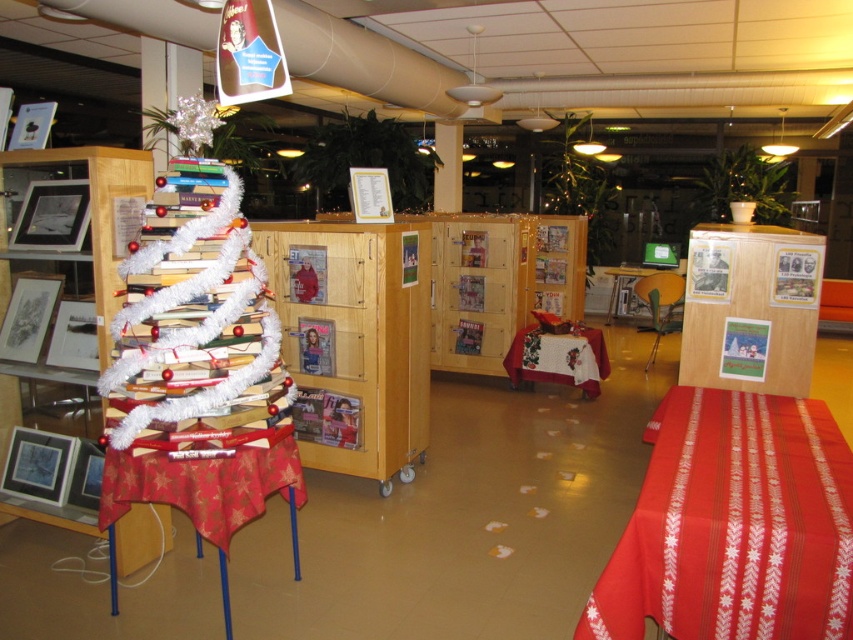
Question: Which is nearer to the red fabric tablecloth at lower right?

Choices:
 (A) white wooden bookshelf at left
 (B) green plastic table at center

Answer: (A)

Question: Is white tinsel book at left to the right of green plastic table at center from the viewer's perspective?

Choices:
 (A) no
 (B) yes

Answer: (A)

Question: Is red fabric tablecloth at lower right wider than embroidered fabric tablecloth at center?

Choices:
 (A) yes
 (B) no

Answer: (A)

Question: Which is nearer to the white wooden bookshelf at left?

Choices:
 (A) wooden bookshelf at center
 (B) green plastic table at center
 (C) red fabric tablecloth at lower right
 (D) red fabric table at left

Answer: (D)

Question: Which of these objects is positioned farthest from the white wooden bookshelf at left?

Choices:
 (A) red fabric tablecloth at lower right
 (B) white tinsel book at left

Answer: (A)

Question: Can you confirm if wooden bookshelf at center is positioned to the left of red fabric table at left?

Choices:
 (A) no
 (B) yes

Answer: (A)